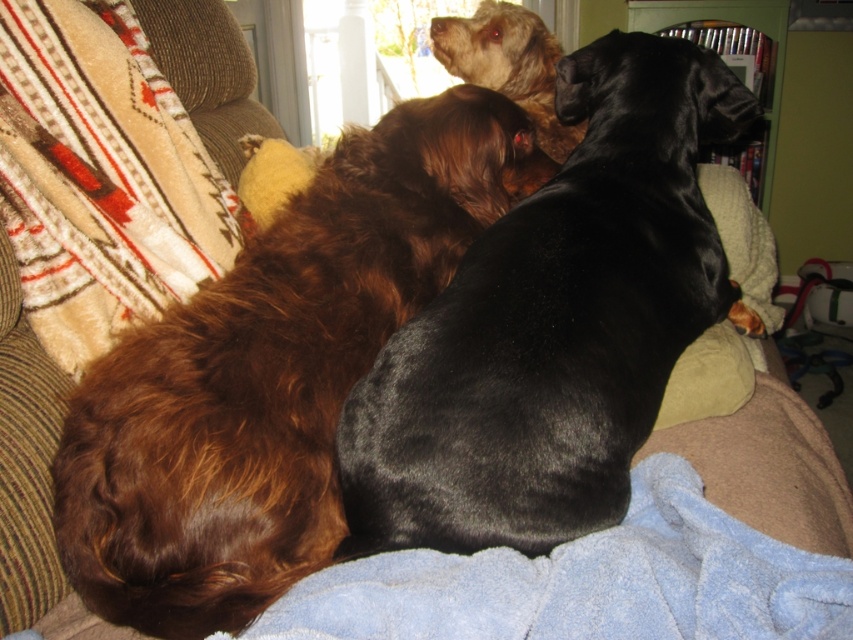
You are a photographer trying to capture a photo of the shiny black dog at center and the light brown fur at upper center. Which dog should you focus on first if you want to ensure both are in focus?

The shiny black dog at center is below light brown fur at upper center, so you should focus on the light brown fur at upper center first to ensure both are in focus.

You are a photographer trying to capture a closeup of the light brown fur at upper center without moving the blue fleece blanket at center. Is the blanket in the way of the fur?

The blue fleece blanket at center is positioned on the left side of the light brown fur at upper center, so it is not blocking the fur. You can take the closeup without moving the blanket.

You are a dog owner who wants to place a new dog bed in the living room. The bed is 20 inches tall. You see the shiny black dog at center and the beige fuzzy blanket at left in the scene. Which object is taller than the dog bed?

The shiny black dog at center is taller than the beige fuzzy blanket at left, so the shiny black dog at center is taller than the dog bed.